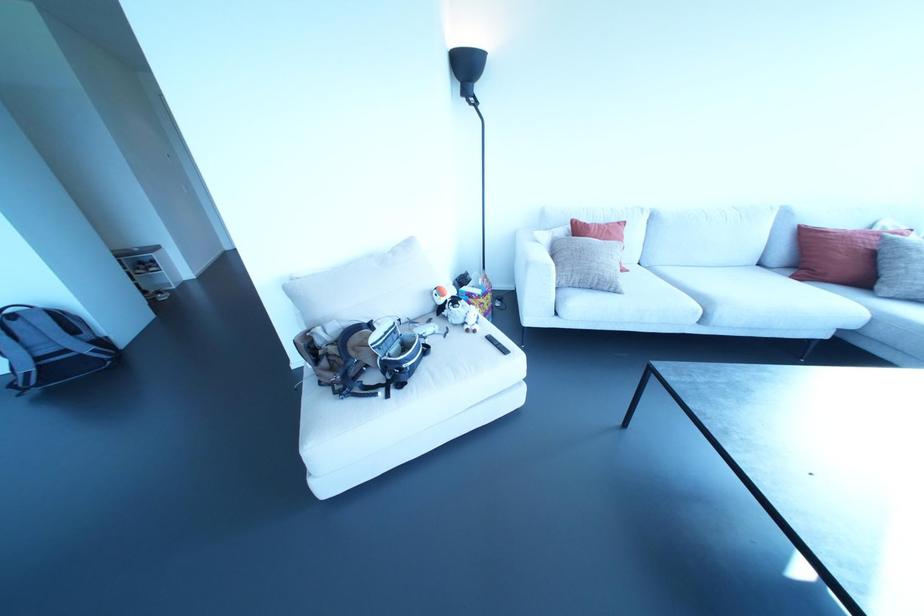
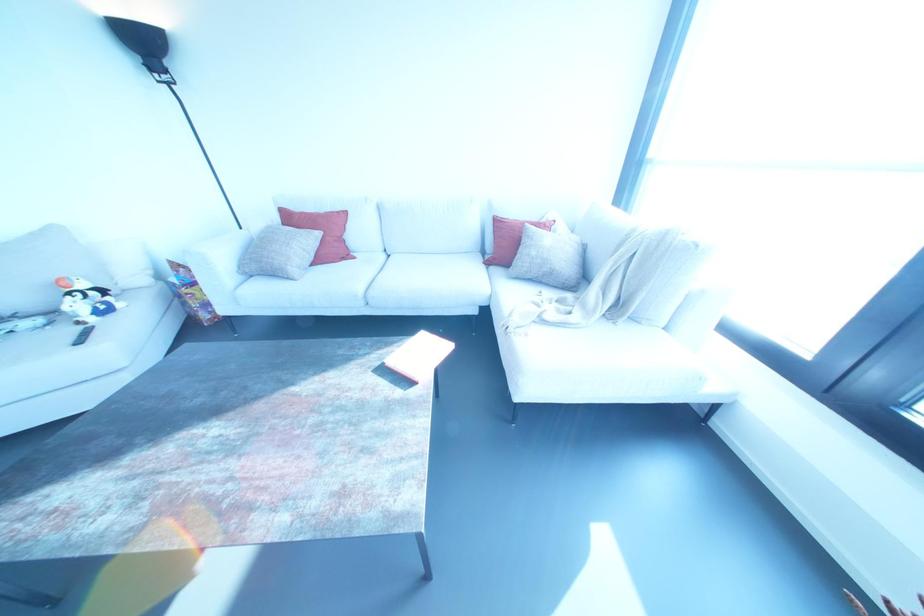
Locate, in the second image, the point that corresponds to point (614, 291) in the first image.

(287, 277)